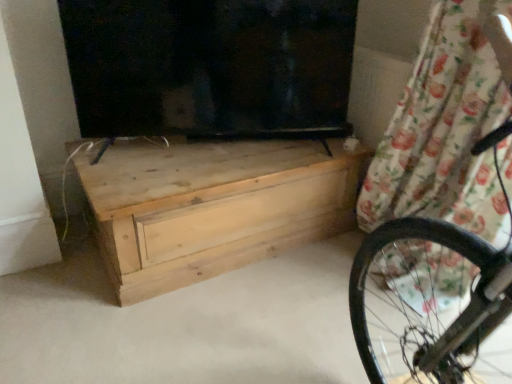
I want to click on natural wood chest of drawers at center, so click(x=213, y=206).

What do you see at coordinates (213, 206) in the screenshot?
I see `natural wood chest of drawers at center` at bounding box center [213, 206].

What do you see at coordinates (442, 132) in the screenshot?
I see `floral fabric curtain at upper right` at bounding box center [442, 132].

Where is `floral fabric curtain at upper right`? The width and height of the screenshot is (512, 384). floral fabric curtain at upper right is located at coordinates (442, 132).

Where is `natural wood chest of drawers at center`? natural wood chest of drawers at center is located at coordinates (213, 206).

Based on the photo, is floral fabric curtain at upper right to the right of natural wood chest of drawers at center from the viewer's perspective?

Yes, floral fabric curtain at upper right is to the right of natural wood chest of drawers at center.

In the image, is floral fabric curtain at upper right positioned in front of or behind natural wood chest of drawers at center?

Visually, floral fabric curtain at upper right is located in front of natural wood chest of drawers at center.

Does point (390, 160) come farther from viewer compared to point (230, 193)?

That is True.

From the image's perspective, which is below, floral fabric curtain at upper right or natural wood chest of drawers at center?

From the image's view, natural wood chest of drawers at center is below.

From a real-world perspective, who is located higher, floral fabric curtain at upper right or natural wood chest of drawers at center?

From a 3D spatial view, floral fabric curtain at upper right is above.

Which object is wider, floral fabric curtain at upper right or natural wood chest of drawers at center?

Wider between the two is natural wood chest of drawers at center.

Does floral fabric curtain at upper right have a greater height compared to natural wood chest of drawers at center?

Yes.

Which of these two, floral fabric curtain at upper right or natural wood chest of drawers at center, is smaller?

With smaller size is floral fabric curtain at upper right.

Is floral fabric curtain at upper right not within natural wood chest of drawers at center?

Yes, floral fabric curtain at upper right is located beyond the bounds of natural wood chest of drawers at center.

Are floral fabric curtain at upper right and natural wood chest of drawers at center located far from each other?

No, there isn't a large distance between floral fabric curtain at upper right and natural wood chest of drawers at center.

Is floral fabric curtain at upper right oriented towards natural wood chest of drawers at center?

No, floral fabric curtain at upper right does not turn towards natural wood chest of drawers at center.

Looking at this image, how different are the orientations of floral fabric curtain at upper right and natural wood chest of drawers at center in degrees?

90.1 degrees.

You are a GUI agent. You are given a task and a screenshot of the screen. Output one action in this format:
    pyautogui.click(x=<x>, y=<y>)
    Task: Click on the chest of drawers lying behind the floral fabric curtain at upper right
    This screenshot has width=512, height=384.
    Given the screenshot: What is the action you would take?
    pyautogui.click(x=213, y=206)

Which object is positioned more to the right, natural wood chest of drawers at center or floral fabric curtain at upper right?

Positioned to the right is floral fabric curtain at upper right.

Is natural wood chest of drawers at center behind floral fabric curtain at upper right?

Yes, natural wood chest of drawers at center is further from the camera.

Is point (123, 213) closer to camera compared to point (398, 110)?

That is True.

From the image's perspective, is natural wood chest of drawers at center above or below floral fabric curtain at upper right?

Based on their image positions, natural wood chest of drawers at center is located beneath floral fabric curtain at upper right.

From a real-world perspective, is natural wood chest of drawers at center positioned under floral fabric curtain at upper right based on gravity?

Correct, in the physical world, natural wood chest of drawers at center is lower than floral fabric curtain at upper right.

Does natural wood chest of drawers at center have a lesser width compared to floral fabric curtain at upper right?

No, natural wood chest of drawers at center is not thinner than floral fabric curtain at upper right.

Between natural wood chest of drawers at center and floral fabric curtain at upper right, which one has more height?

With more height is floral fabric curtain at upper right.

Based on their sizes in the image, would you say natural wood chest of drawers at center is bigger or smaller than floral fabric curtain at upper right?

In the image, natural wood chest of drawers at center appears to be larger than floral fabric curtain at upper right.

Is natural wood chest of drawers at center inside the boundaries of floral fabric curtain at upper right, or outside?

natural wood chest of drawers at center is spatially situated outside floral fabric curtain at upper right.

Are natural wood chest of drawers at center and floral fabric curtain at upper right located far from each other?

That's not correct — natural wood chest of drawers at center is a little close to floral fabric curtain at upper right.

Is natural wood chest of drawers at center turned away from floral fabric curtain at upper right?

natural wood chest of drawers at center does not have its back to floral fabric curtain at upper right.

Can you tell me how much natural wood chest of drawers at center and floral fabric curtain at upper right differ in facing direction?

The facing directions of natural wood chest of drawers at center and floral fabric curtain at upper right are 90.1 degrees apart.

In order to click on chest of drawers on the left of floral fabric curtain at upper right in this screenshot , I will do `click(213, 206)`.

Identify the location of curtain above the natural wood chest of drawers at center (from a real-world perspective). The image size is (512, 384). (442, 132).

The image size is (512, 384). I want to click on chest of drawers lying on the left of floral fabric curtain at upper right, so click(x=213, y=206).